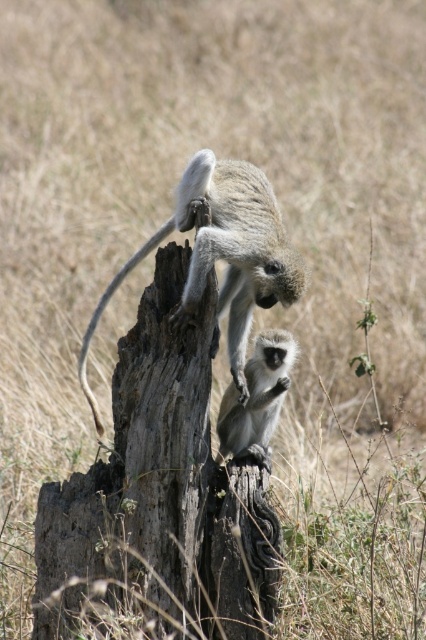
You are a wildlife photographer trying to capture a closeup of the monkey on the tree stump. You notice two points of interest marked as point 1 at coordinates [175,276] and point 2 at coordinates [94,317]. Which point should you focus on to get a clearer image of the monkey closer to the viewer?

Point 1 at coordinates [175,276] is closer to the viewer than point 2 at coordinates [94,317], so focusing on point 1 will provide a clearer image of the monkey closer to the viewer.